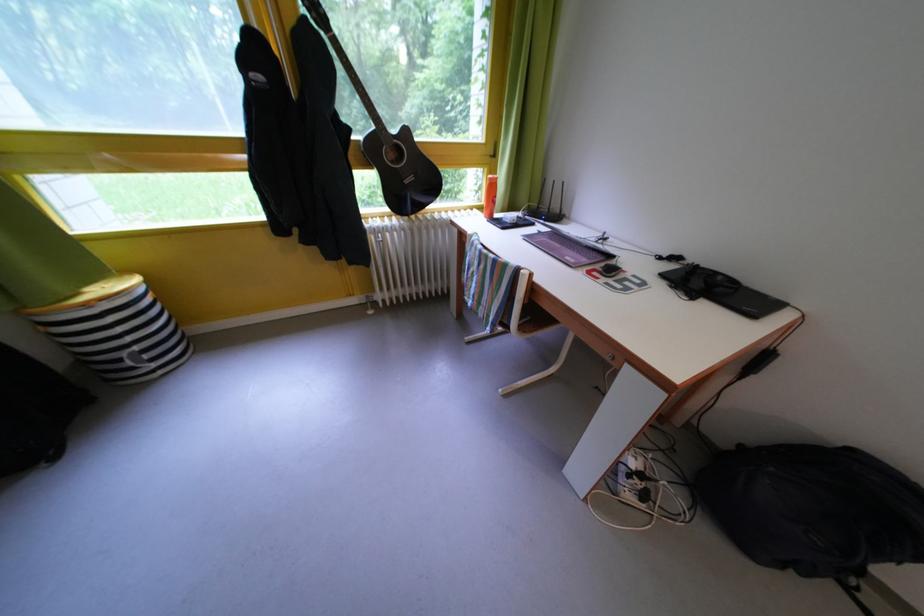
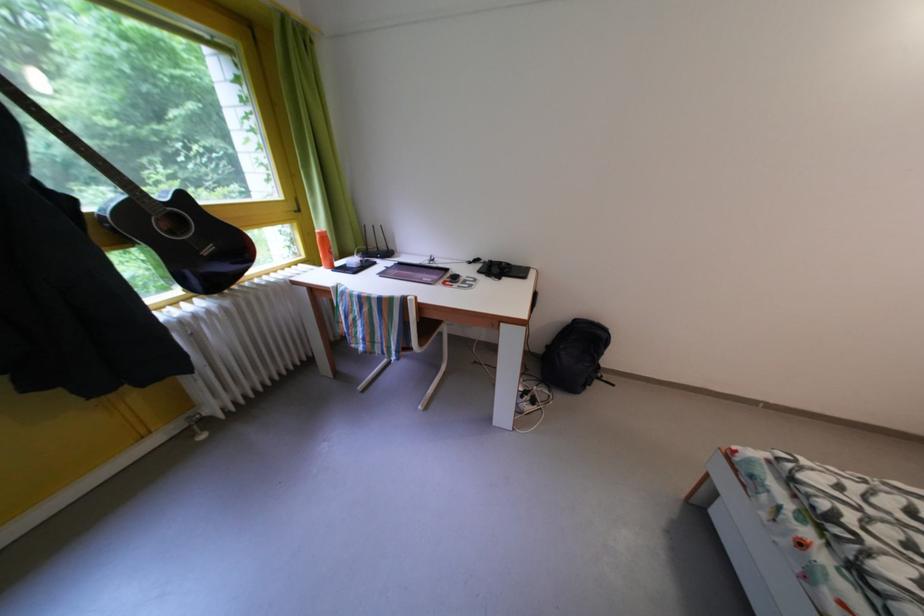
Locate, in the second image, the point that corresponds to [416,138] in the first image.

(191, 203)